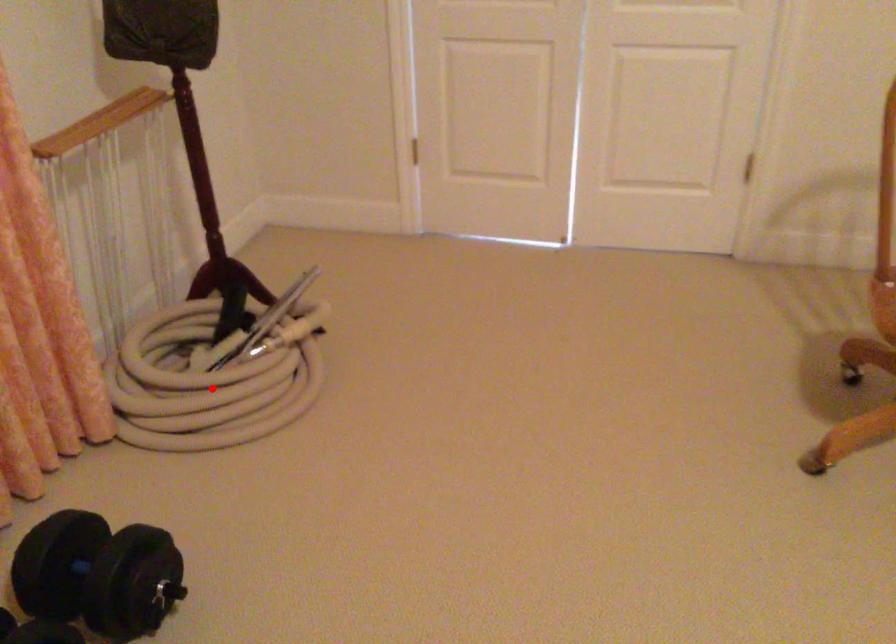
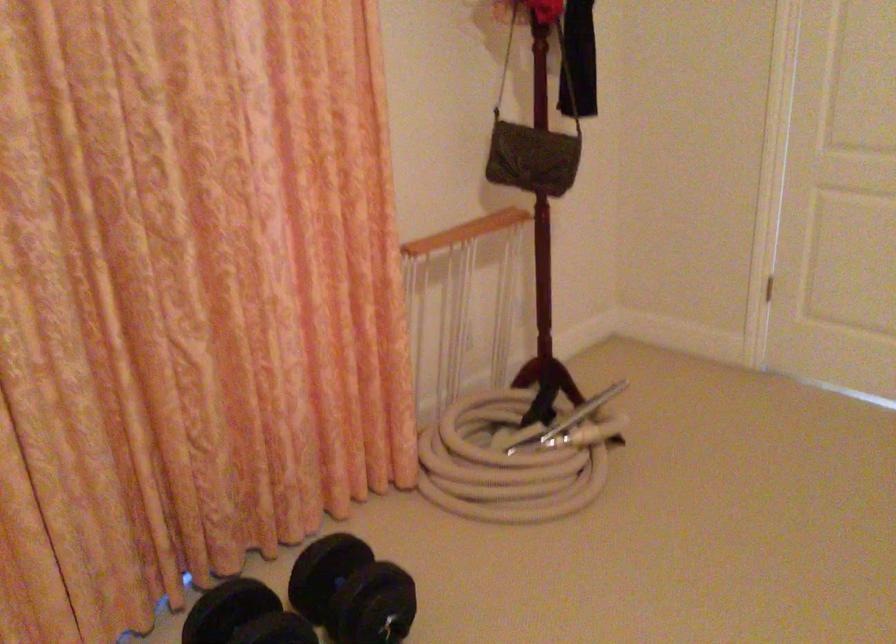
Question: A red point is marked in image1. In image2, is the corresponding 3D point closer to the camera or farther? Reply with the corresponding letter.

Choices:
 (A) The corresponding 3D point is closer.
 (B) The corresponding 3D point is farther.

Answer: (B)